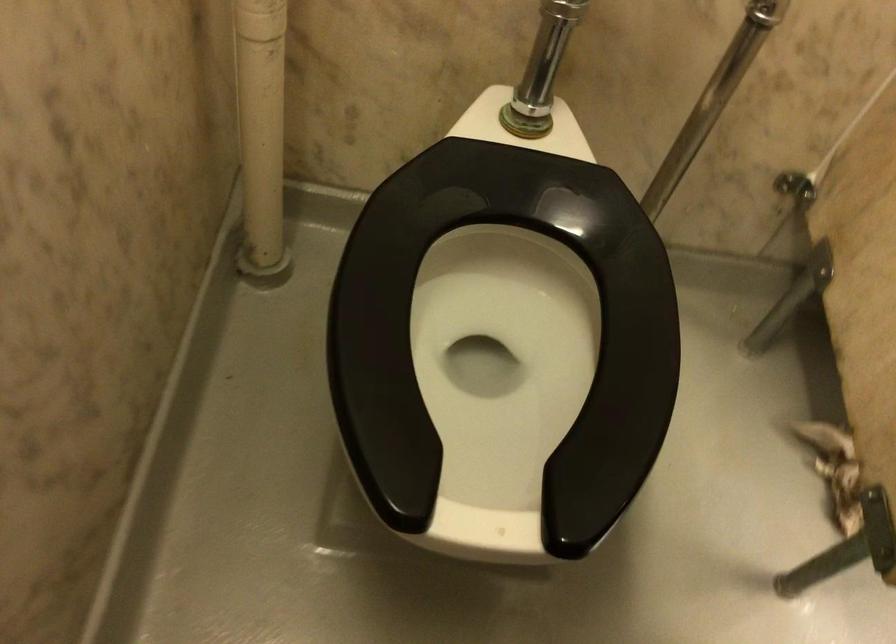
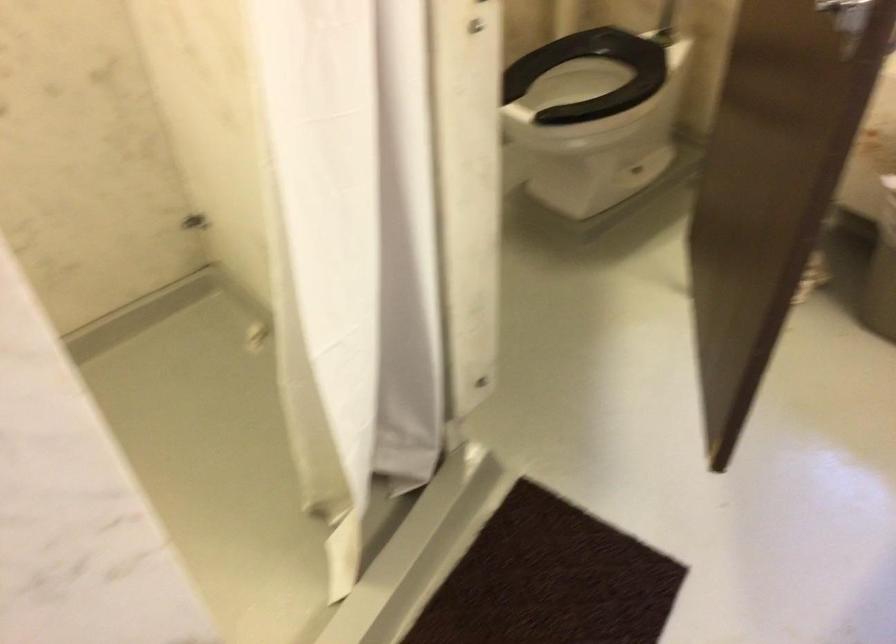
Where in the second image is the point corresponding to the point at 426,248 from the first image?

(591, 75)